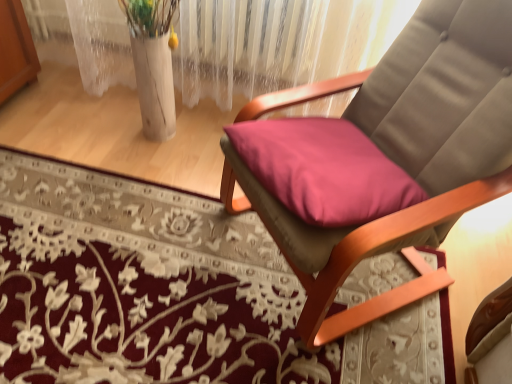
Question: Is floral carpet at center facing away from matte pink cushion at center?

Choices:
 (A) no
 (B) yes

Answer: (A)

Question: Considering the relative sizes of floral carpet at center and matte pink cushion at center in the image provided, is floral carpet at center shorter than matte pink cushion at center?

Choices:
 (A) no
 (B) yes

Answer: (B)

Question: Considering the relative positions of floral carpet at center and matte pink cushion at center in the image provided, is floral carpet at center behind matte pink cushion at center?

Choices:
 (A) no
 (B) yes

Answer: (B)

Question: From the image's perspective, would you say floral carpet at center is positioned over matte pink cushion at center?

Choices:
 (A) no
 (B) yes

Answer: (A)

Question: From the image's perspective, is floral carpet at center beneath matte pink cushion at center?

Choices:
 (A) yes
 (B) no

Answer: (A)

Question: From a real-world perspective, is floral carpet at center physically below matte pink cushion at center?

Choices:
 (A) no
 (B) yes

Answer: (B)

Question: Is matte pink cushion at center wider than floral carpet at center?

Choices:
 (A) no
 (B) yes

Answer: (A)

Question: Is matte pink cushion at center thinner than floral carpet at center?

Choices:
 (A) no
 (B) yes

Answer: (B)

Question: From a real-world perspective, is matte pink cushion at center beneath floral carpet at center?

Choices:
 (A) yes
 (B) no

Answer: (B)

Question: Is the surface of matte pink cushion at center in direct contact with floral carpet at center?

Choices:
 (A) no
 (B) yes

Answer: (A)

Question: Is matte pink cushion at center positioned behind floral carpet at center?

Choices:
 (A) yes
 (B) no

Answer: (B)

Question: Does matte pink cushion at center have a larger size compared to floral carpet at center?

Choices:
 (A) no
 (B) yes

Answer: (B)

Question: In terms of size, does matte pink cushion at center appear bigger or smaller than floral carpet at center?

Choices:
 (A) small
 (B) big

Answer: (B)